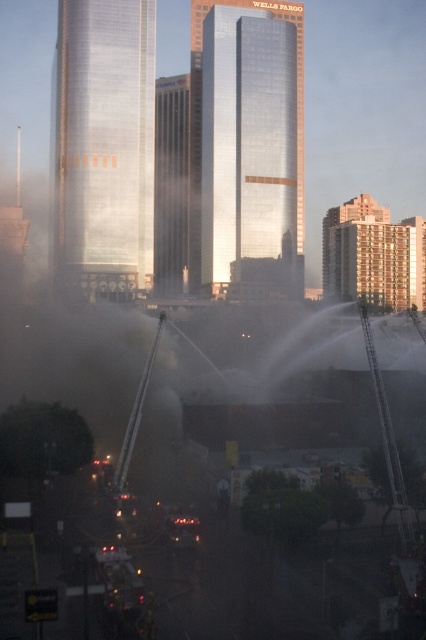
Does reflective glass skyscraper at center come behind glossy glass skyscraper at center?

No.

Which is behind, point (172, 259) or point (302, 100)?

Positioned behind is point (172, 259).

This screenshot has height=640, width=426. Find the location of `reflective glass skyscraper at center`. reflective glass skyscraper at center is located at coordinates (170, 186).

Is shiny metallic skyscraper at center positioned in front of reflective glass skyscraper at center?

Yes, shiny metallic skyscraper at center is closer to the viewer.

Is point (66, 234) behind point (161, 227)?

No, it is not.

You are a GUI agent. You are given a task and a screenshot of the screen. Output one action in this format:
    pyautogui.click(x=<x>, y=<y>)
    Task: Click on the shiny metallic skyscraper at center
    Image resolution: width=426 pixels, height=640 pixels.
    Given the screenshot: What is the action you would take?
    pyautogui.click(x=103, y=147)

Is shiny metallic skyscraper at center positioned before glossy glass skyscraper at center?

Yes, it is in front of glossy glass skyscraper at center.

Based on the photo, is shiny metallic skyscraper at center taller than glossy glass skyscraper at center?

No, shiny metallic skyscraper at center is not taller than glossy glass skyscraper at center.

I want to click on shiny metallic skyscraper at center, so click(x=103, y=147).

Identify the location of shiny metallic skyscraper at center. (103, 147).